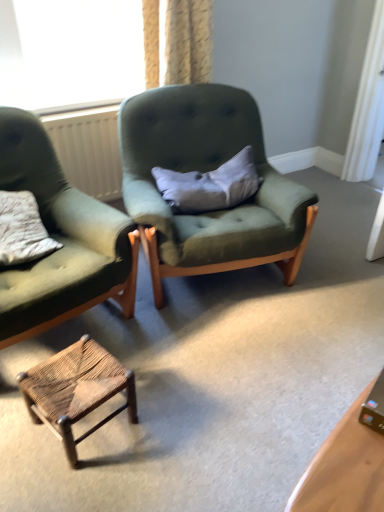
Find the location of `blank space situated above rustic woven stool at lower center (from a real-world perspective)`. blank space situated above rustic woven stool at lower center (from a real-world perspective) is located at coordinates (76, 379).